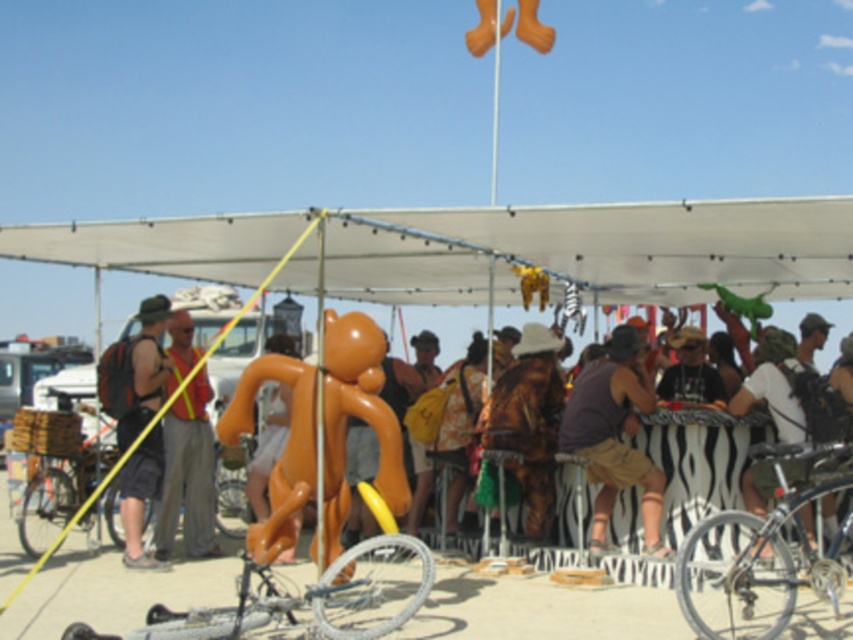
Question: Is the position of silver metallic bicycle at lower center more distant than that of matte brown hat at center?

Choices:
 (A) yes
 (B) no

Answer: (B)

Question: Where is brown fabric shirt at center located in relation to gold metallic costume at center in the image?

Choices:
 (A) below
 (B) above

Answer: (A)

Question: Estimate the real-world distances between objects in this image. Which object is farther from the orange rubber monkey at center?

Choices:
 (A) matte black backpack at left
 (B) silver metallic bicycle at lower right
 (C) gold metallic costume at center
 (D) brown fabric shirt at center

Answer: (B)

Question: Which of the following is the closest to the observer?

Choices:
 (A) orange rubber monkey at center
 (B) matte orange balloon at left
 (C) silver metallic bicycle at lower right
 (D) matte brown hat at center

Answer: (C)

Question: Does silver metallic bicycle at lower center appear over white matte bicycle at right?

Choices:
 (A) yes
 (B) no

Answer: (B)

Question: Which object is positioned closest to the matte orange balloon at left?

Choices:
 (A) gold metallic costume at center
 (B) matte brown hat at center
 (C) silver metallic bicycle at lower center
 (D) orange rubber monkey at center

Answer: (D)